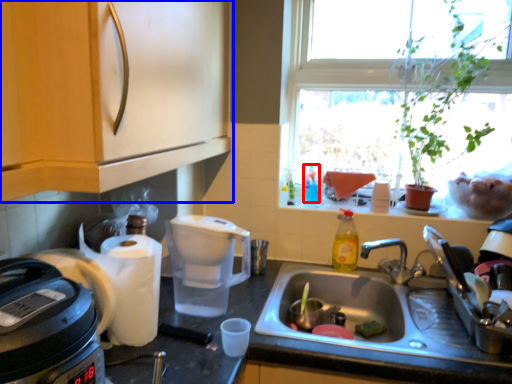
Question: Which object appears closest to the camera in this image, bottle (highlighted by a red box) or cabinetry (highlighted by a blue box)?

Choices:
 (A) bottle
 (B) cabinetry

Answer: (B)